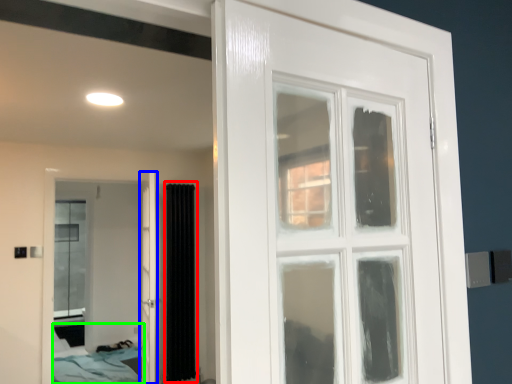
Question: Estimate the real-world distances between objects in this image. Which object is closer to curtain (highlighted by a red box), door (highlighted by a blue box) or bed (highlighted by a green box)?

Choices:
 (A) door
 (B) bed

Answer: (A)